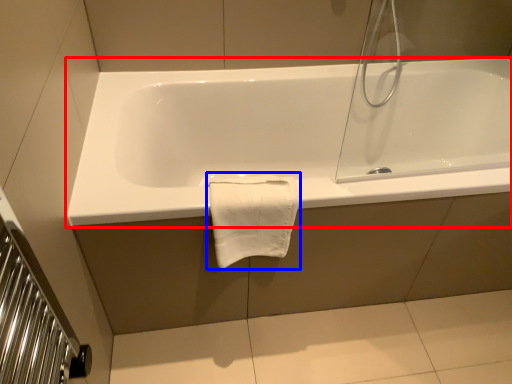
Question: Which point is further to the camera, bathtub (highlighted by a red box) or bath towel (highlighted by a blue box)?

Choices:
 (A) bathtub
 (B) bath towel

Answer: (A)